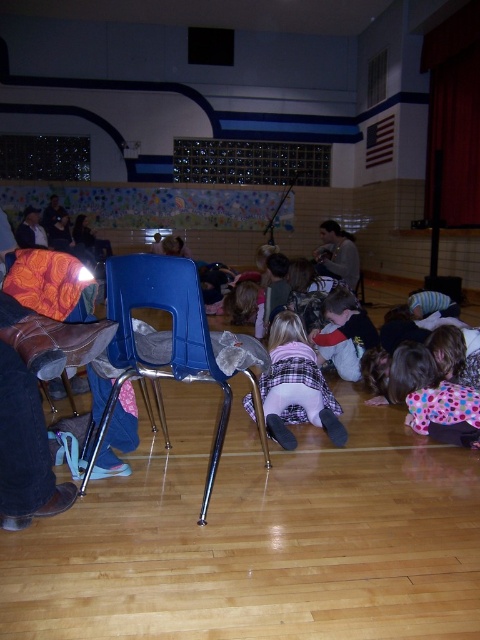
Question: In this image, where is plaid fabric pants at center located relative to polka dot fabric dress at lower right?

Choices:
 (A) right
 (B) left

Answer: (B)

Question: Considering the real-world distances, which object is farthest from the polka dot fabric dress at lower right?

Choices:
 (A) plaid fabric pants at center
 (B) blue plastic chair at center

Answer: (B)

Question: Which point is closer to the camera taking this photo?

Choices:
 (A) (337, 422)
 (B) (173, 275)
 (C) (400, 364)

Answer: (B)

Question: From the image, what is the correct spatial relationship of plaid fabric pants at center in relation to polka dot fabric dress at lower right?

Choices:
 (A) right
 (B) left

Answer: (B)

Question: Can you confirm if plaid fabric pants at center is bigger than polka dot fabric dress at lower right?

Choices:
 (A) yes
 (B) no

Answer: (A)

Question: Which object appears closest to the camera in this image?

Choices:
 (A) plaid fabric pants at center
 (B) blue plastic chair at center

Answer: (B)